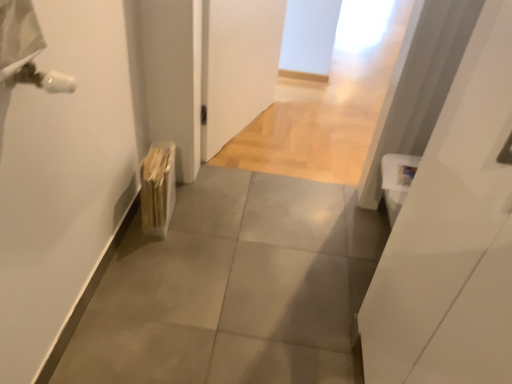
Question: Looking at the image, does white glossy door at right seem bigger or smaller compared to gray tile floor at center?

Choices:
 (A) big
 (B) small

Answer: (B)

Question: Looking at their shapes, would you say white glossy door at right is wider or thinner than gray tile floor at center?

Choices:
 (A) thin
 (B) wide

Answer: (A)

Question: Which of these objects is positioned closest to the wooden radiator at lower left?

Choices:
 (A) white glossy door at right
 (B) gray tile floor at center

Answer: (B)

Question: Which object is the closest to the white glossy door at right?

Choices:
 (A) gray tile floor at center
 (B) wooden radiator at lower left

Answer: (A)